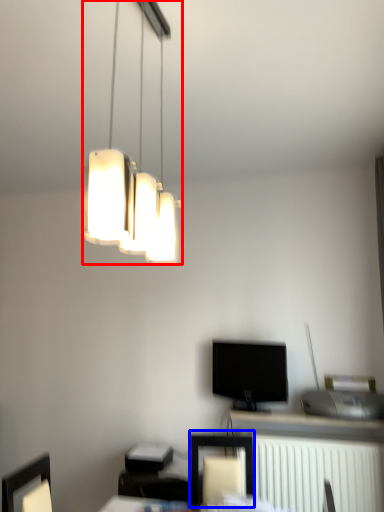
Question: Which object is closer to the camera taking this photo, lamp (highlighted by a red box) or furniture (highlighted by a blue box)?

Choices:
 (A) lamp
 (B) furniture

Answer: (A)